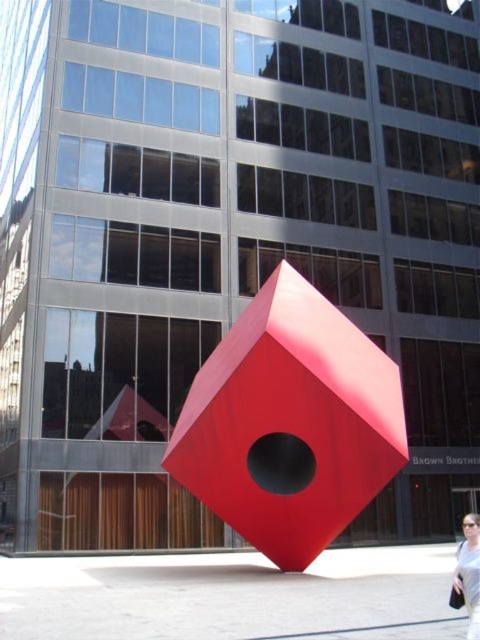
You are standing in the urban scene and want to walk from the point at coordinates point (289, 557) to the point at coordinates point (460, 564). Which direction should you face to move towards the second point?

Since point (289, 557) is behind point (460, 564), you should face forward towards the direction of the point (460, 564) to move towards it.

You are standing in the urban scene and want to place a small flower pot exactly at the point marked as point (289,422). The flower pot must be placed on a solid surface. Can you confirm if the point is on a solid surface?

Yes, the point (289,422) is on the matte red cube at center, which is a solid surface.

You are a photographer standing in front of the matte red cube at center and the matte black sunglasses at lower right. You want to take a photo that captures both objects in the frame. Which object should you position closer to the camera to ensure both are fully visible?

The matte red cube at center is much taller than the matte black sunglasses at lower right. To ensure both are fully visible in the photo, you should position the matte black sunglasses at lower right closer to the camera since it is shorter and needs to be enlarged in the frame to match the scale of the taller matte red cube at center.